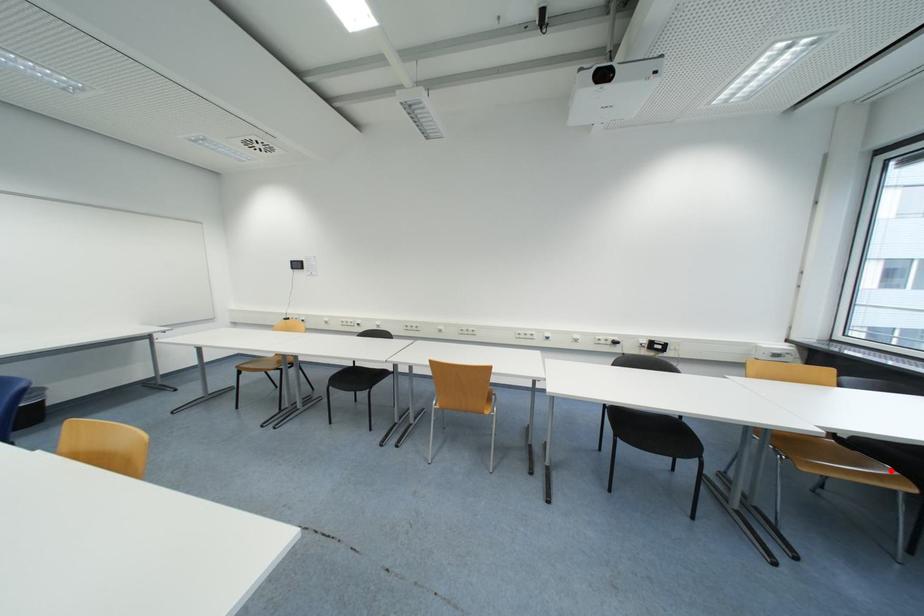
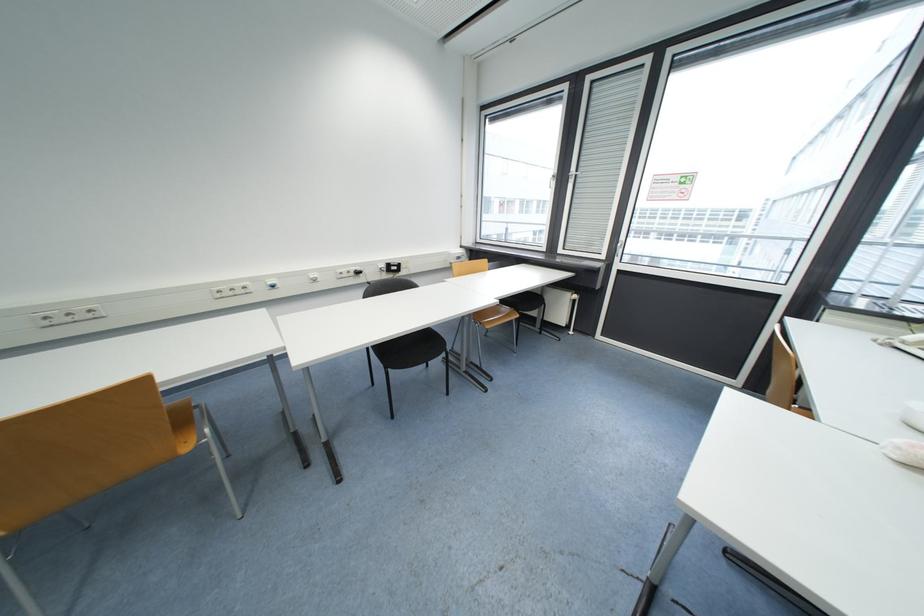
Question: I am providing you with two images of the same scene from different viewpoints. In image1, a red point is highlighted. Considering the same 3D point in image2, which of the following is correct?

Choices:
 (A) It is closer
 (B) It is farther

Answer: (B)